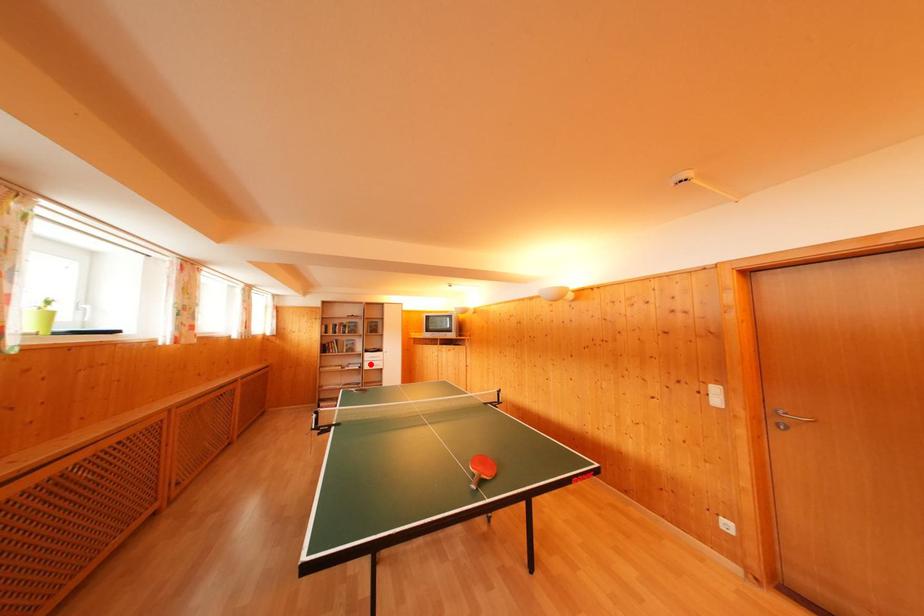
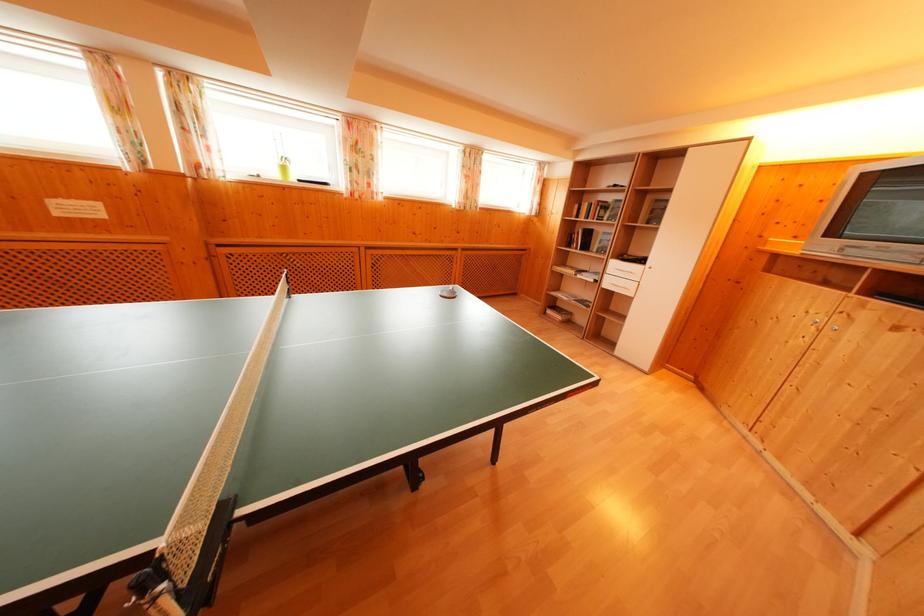
The point at the highlighted location is marked in the first image. Where is the corresponding point in the second image?

(614, 276)